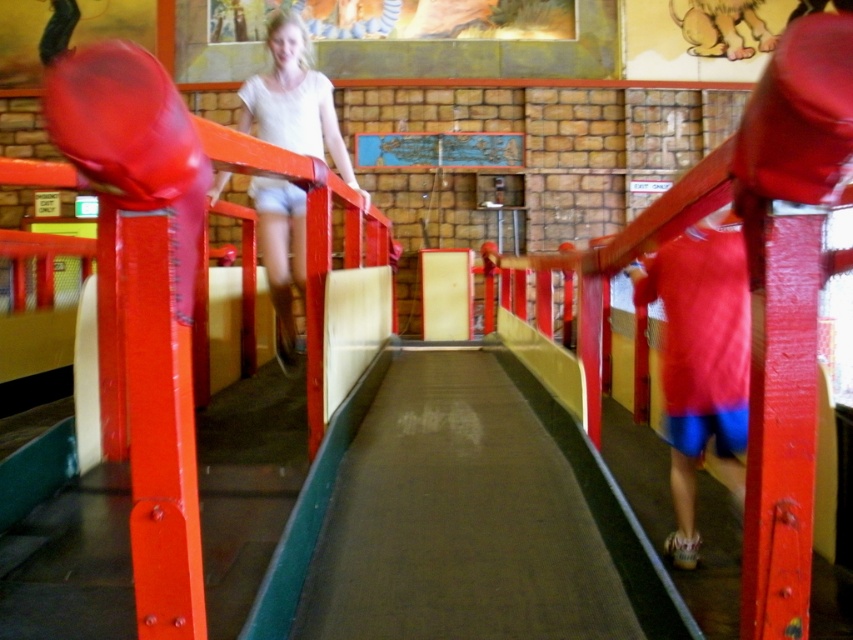
Question: Can you confirm if red fabric shorts at center is bigger than white matte shorts at upper center?

Choices:
 (A) yes
 (B) no

Answer: (B)

Question: Which point is closer to the camera taking this photo?

Choices:
 (A) (299, 241)
 (B) (746, 252)

Answer: (B)

Question: Does red fabric shorts at center have a larger size compared to white matte shorts at upper center?

Choices:
 (A) yes
 (B) no

Answer: (B)

Question: From the image, what is the correct spatial relationship of red fabric shorts at center in relation to white matte shorts at upper center?

Choices:
 (A) right
 (B) left

Answer: (A)

Question: Which of the following is the closest to the observer?

Choices:
 (A) (274, 280)
 (B) (677, 282)

Answer: (B)

Question: Which point appears farthest from the camera in this image?

Choices:
 (A) (289, 49)
 (B) (741, 420)

Answer: (A)